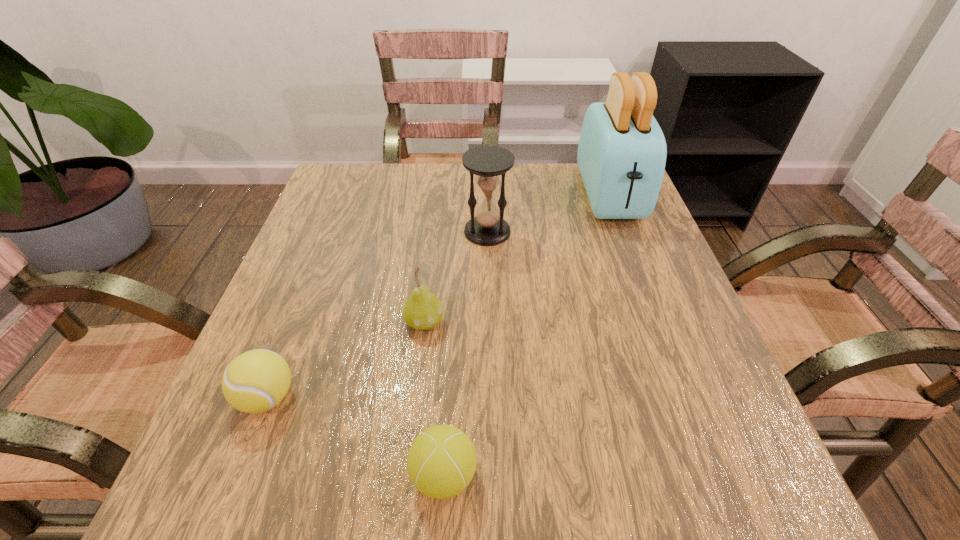
In order to click on free area in between the pear and the right tennis ball in this screenshot , I will do click(x=434, y=398).

The image size is (960, 540). Identify the location of free spot between the farther tennis ball and the hourglass. (377, 314).

This screenshot has height=540, width=960. Find the location of `blank region between the nearest object and the tallest object`. blank region between the nearest object and the tallest object is located at coordinates (527, 335).

Where is `empty location between the second tallest object and the rightmost object`? empty location between the second tallest object and the rightmost object is located at coordinates (548, 213).

This screenshot has height=540, width=960. Identify the location of free space between the nearer tennis ball and the pear. (434, 398).

Select which object is the third closest to the second nearest object. Please provide its 2D coordinates. Your answer should be formatted as a tuple, i.e. [(x, y)], where the tuple contains the x and y coordinates of a point satisfying the conditions above.

[(488, 164)]

Where is `the closest object to the pear`? the closest object to the pear is located at coordinates (255, 381).

Locate an element on the screen. The height and width of the screenshot is (540, 960). free space in the image that satisfies the following two spatial constraints: 1. on the front side of the right tennis ball; 2. on the left side of the left tennis ball is located at coordinates (237, 475).

Where is `free spot that satisfies the following two spatial constraints: 1. on the back side of the hourglass; 2. on the right side of the third tallest object`? This screenshot has width=960, height=540. free spot that satisfies the following two spatial constraints: 1. on the back side of the hourglass; 2. on the right side of the third tallest object is located at coordinates (435, 232).

Find the location of a particular element. This screenshot has height=540, width=960. vacant space that satisfies the following two spatial constraints: 1. on the back side of the second tallest object; 2. on the left side of the nearest object is located at coordinates (458, 232).